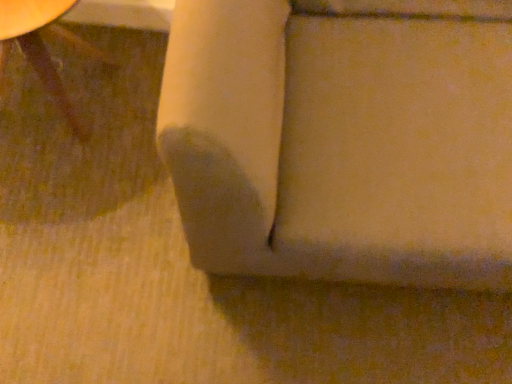
Locate an element on the screen. The image size is (512, 384). free area below matte brown wood table at lower left, placed as the second furniture when sorted from right to left (from a real-world perspective) is located at coordinates (65, 86).